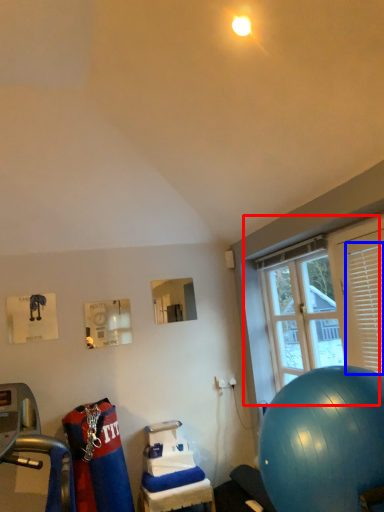
Question: Among these objects, which one is farthest to the camera, window (highlighted by a red box) or shutter (highlighted by a blue box)?

Choices:
 (A) window
 (B) shutter

Answer: (A)